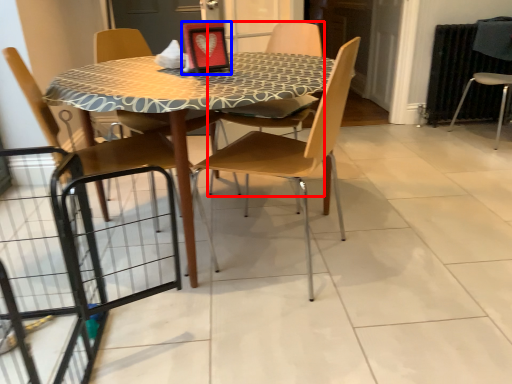
Question: Which object appears closest to the camera in this image, chair (highlighted by a red box) or picture frame (highlighted by a blue box)?

Choices:
 (A) chair
 (B) picture frame

Answer: (B)